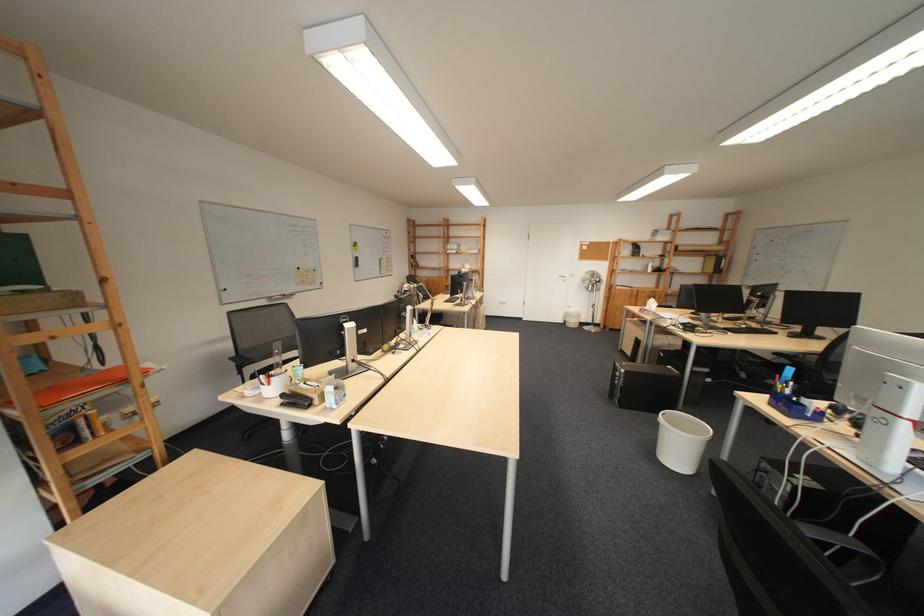
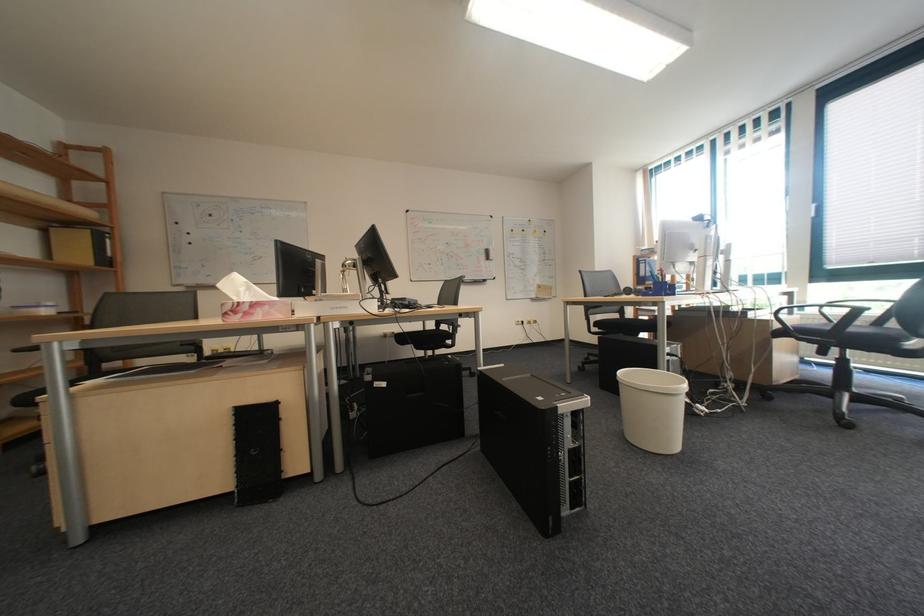
Locate, in the second image, the point that corresponds to (676,357) in the first image.

(398, 386)